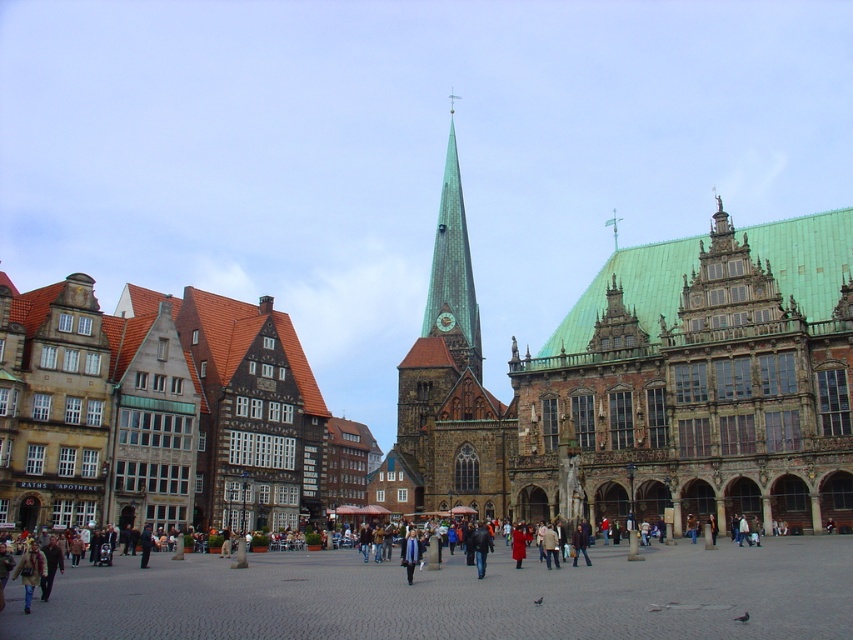
You are a tourist standing in the historic European city square. You notice the brown cobblestone square at center and the green copper steeple at center. Which object is positioned to the right of the other?

The brown cobblestone square at center is to the right of the green copper steeple at center.

You are a tourist standing in the square and want to place your blue fabric scarf at center on the ground. However, there is a brown cobblestone square at center already occupying the spot. Can you place your scarf there without moving the cobblestone?

The brown cobblestone square at center is positioned over blue fabric scarf at center, meaning the cobblestone is already covering the area where you want to place the scarf. Therefore, you cannot place your blue fabric scarf at center there without moving the cobblestone.